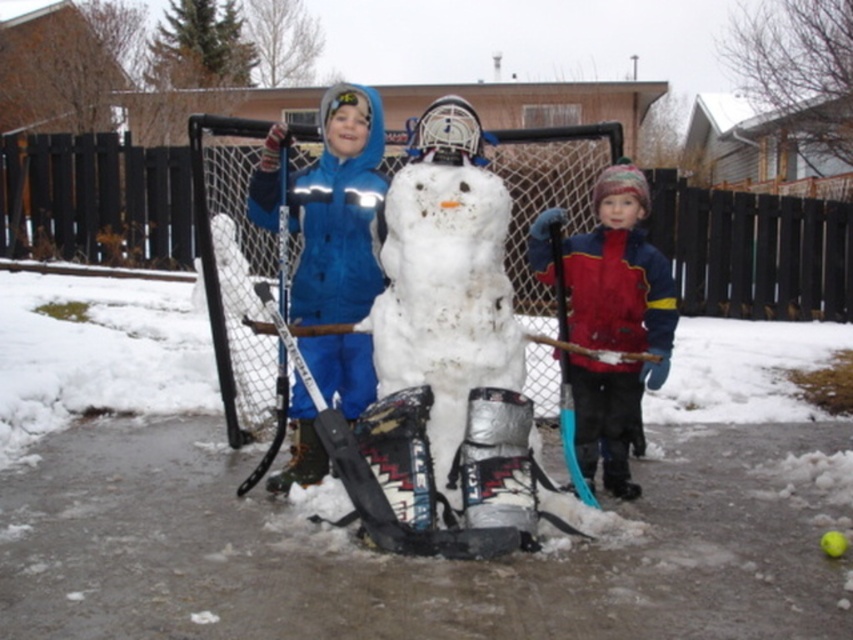
Question: Is blue fabric snowman at center closer to the viewer compared to red fleece jacket at right?

Choices:
 (A) no
 (B) yes

Answer: (A)

Question: Which object appears farthest from the camera in this image?

Choices:
 (A) white fluffy snow at center
 (B) red fleece jacket at right

Answer: (B)

Question: From the image, what is the correct spatial relationship of red fleece jacket at right in relation to blue plastic hockey stick at right?

Choices:
 (A) left
 (B) right

Answer: (B)

Question: Which object appears farthest from the camera in this image?

Choices:
 (A) white fluffy snow at center
 (B) red fleece jacket at right
 (C) blue fabric snowman at center

Answer: (C)

Question: Which object appears closest to the camera in this image?

Choices:
 (A) blue fabric snowman at center
 (B) red fleece jacket at right

Answer: (B)

Question: Does blue fabric snowman at center have a smaller size compared to red fleece jacket at right?

Choices:
 (A) no
 (B) yes

Answer: (B)